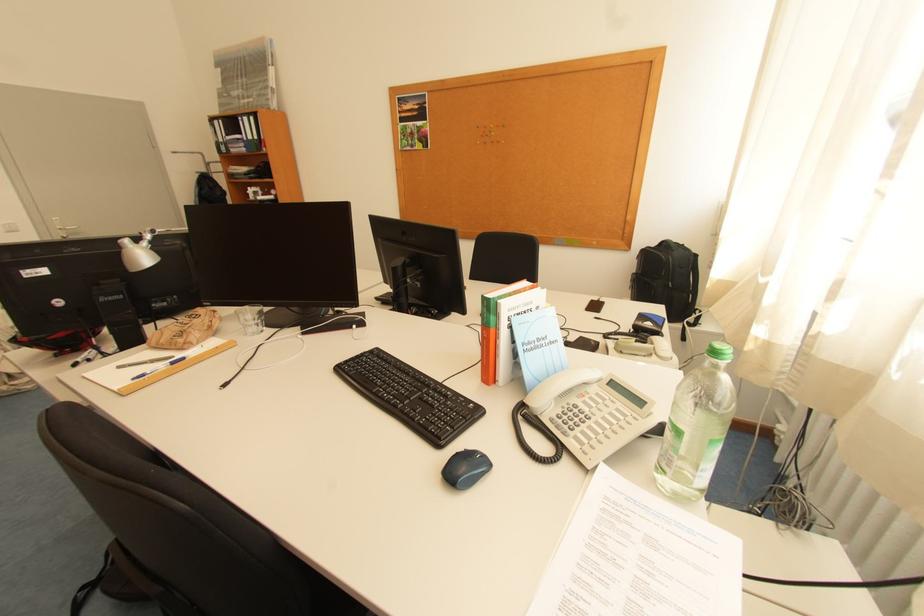
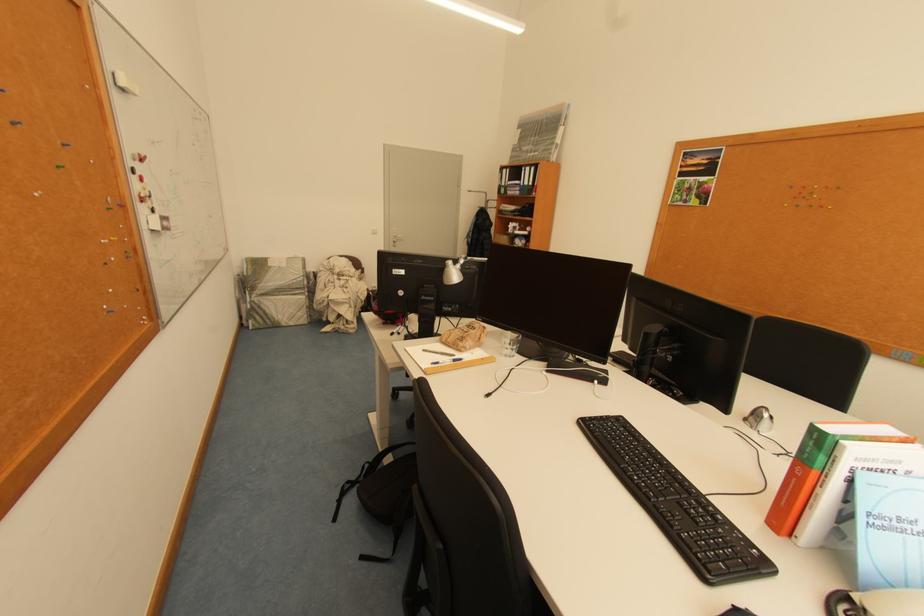
In the second image, find the point that corresponds to (x=492, y=360) in the first image.

(793, 501)